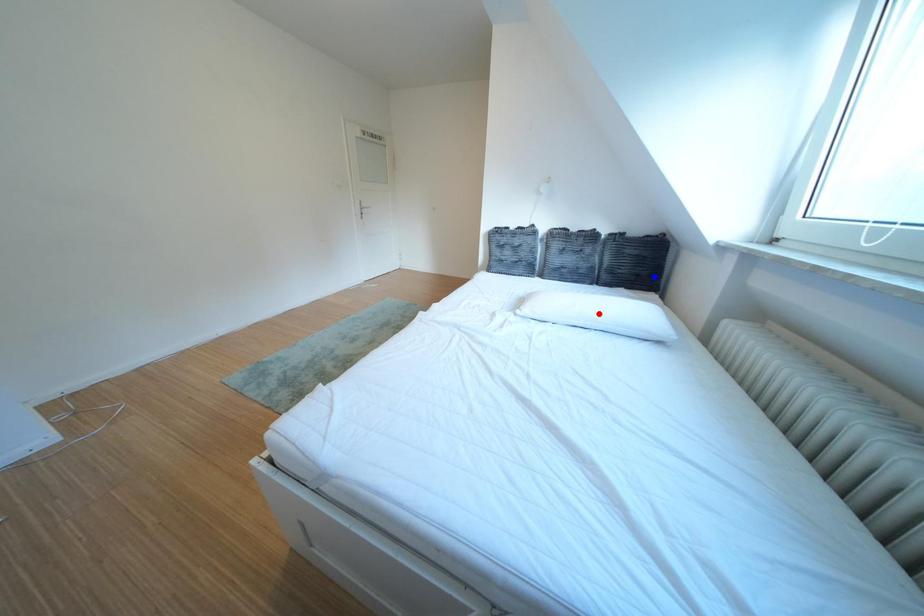
Question: In the image, two points are highlighted. Which point is nearer to the camera? Reply with the corresponding letter.

Choices:
 (A) blue point
 (B) red point

Answer: (B)